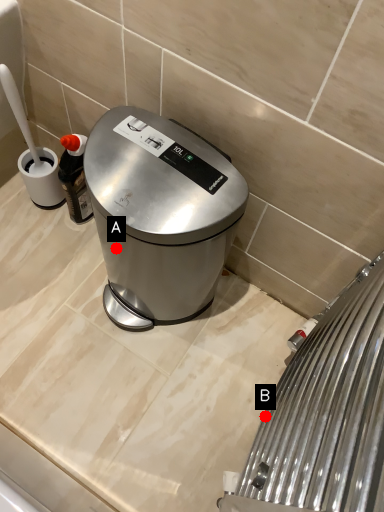
Question: Two points are circled on the image, labeled by A and B beside each circle. Which point is further to the camera?

Choices:
 (A) A is further
 (B) B is further

Answer: (A)